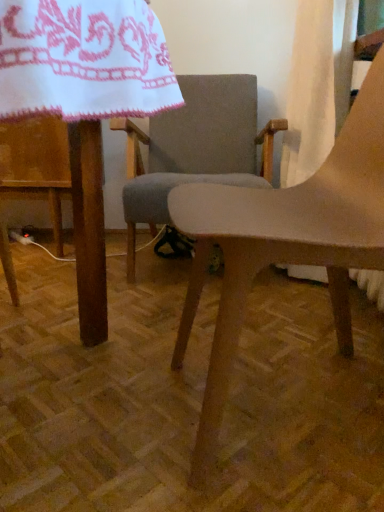
You are a GUI agent. You are given a task and a screenshot of the screen. Output one action in this format:
    pyautogui.click(x=<x>, y=<y>)
    Task: Click on the white embroidered cloth at upper left
    
    Given the screenshot: What is the action you would take?
    pyautogui.click(x=84, y=60)

Measure the distance between matte wood chair at center, the second chair viewed from the back, and camera.

They are 25.62 inches apart.

At what (x,y) coordinates should I click in order to perform the action: click on matte wood table at center. Please return your answer as a coordinate pair (x, y). Looking at the image, I should click on (85, 103).

Describe the element at coordinates (195, 148) in the screenshot. I see `gray fabric chair at center, positioned as the 2th chair in front-to-back order` at that location.

What is the approximate width of gray fabric chair at center, which is the 1th chair in back-to-front order?

29.66 inches.

This screenshot has width=384, height=512. Find the location of `white embroidered cloth at upper left`. white embroidered cloth at upper left is located at coordinates pyautogui.click(x=84, y=60).

Which chair is the 1st one when counting from the right side of the matte wood table at center? Please provide its 2D coordinates.

[(195, 148)]

Does matte wood table at center turn towards gray fabric chair at center, which is the 1th chair in back-to-front order?

No.

Would you say matte wood table at center is a long distance from gray fabric chair at center, which is the 1th chair in back-to-front order?

They are positioned close to each other.

Is white embroidered cloth at upper left with gray fabric chair at center, positioned as the 2th chair in front-to-back order?

white embroidered cloth at upper left is not next to gray fabric chair at center, positioned as the 2th chair in front-to-back order, and they're not touching.

Is white embroidered cloth at upper left inside the boundaries of gray fabric chair at center, positioned as the 2th chair in front-to-back order, or outside?

The correct answer is: outside.

In the scene shown: Which object is wider, white embroidered cloth at upper left or gray fabric chair at center, positioned as the 2th chair in front-to-back order?

gray fabric chair at center, positioned as the 2th chair in front-to-back order, is wider.

Is point (14, 35) closer or farther from the camera than point (166, 157)?

Point (14, 35).

Is matte wood table at center oriented away from white fabric curtain at upper right?

That's not correct — matte wood table at center is not looking away from white fabric curtain at upper right.

Is point (82, 233) positioned before point (290, 79)?

Yes, point (82, 233) is in front of point (290, 79).

The width and height of the screenshot is (384, 512). Find the location of `curtain lying above the matte wood table at center (from the image's perspective)`. curtain lying above the matte wood table at center (from the image's perspective) is located at coordinates (317, 84).

Is the depth of matte wood table at center greater than that of white fabric curtain at upper right?

No, matte wood table at center is in front of white fabric curtain at upper right.

From the image's perspective, between white fabric curtain at upper right and gray fabric chair at center, positioned as the 2th chair in front-to-back order, which one is located above?

From the image's view, white fabric curtain at upper right is above.

Is white fabric curtain at upper right facing towards gray fabric chair at center, positioned as the 2th chair in front-to-back order?

Yes, white fabric curtain at upper right is facing gray fabric chair at center, positioned as the 2th chair in front-to-back order.

Is white fabric curtain at upper right positioned far away from gray fabric chair at center, which is the 1th chair in back-to-front order?

No, white fabric curtain at upper right is in close proximity to gray fabric chair at center, which is the 1th chair in back-to-front order.

Considering the sizes of white fabric curtain at upper right and gray fabric chair at center, positioned as the 2th chair in front-to-back order, in the image, is white fabric curtain at upper right taller or shorter than gray fabric chair at center, positioned as the 2th chair in front-to-back order,?

white fabric curtain at upper right is shorter than gray fabric chair at center, positioned as the 2th chair in front-to-back order.

In order to click on curtain lying in front of the gray fabric chair at center, which is the 1th chair in back-to-front order in this screenshot , I will do `click(317, 84)`.

Considering their positions, is gray fabric chair at center, which is the 1th chair in back-to-front order, located in front of or behind white fabric curtain at upper right?

In the image, gray fabric chair at center, which is the 1th chair in back-to-front order, appears behind white fabric curtain at upper right.

Is gray fabric chair at center, which is the 1th chair in back-to-front order, oriented towards white fabric curtain at upper right?

No, gray fabric chair at center, which is the 1th chair in back-to-front order, does not turn towards white fabric curtain at upper right.

From a real-world perspective, which is physically below, gray fabric chair at center, which is the 1th chair in back-to-front order, or white fabric curtain at upper right?

From a 3D spatial view, gray fabric chair at center, which is the 1th chair in back-to-front order, is below.

Does matte wood chair at center, the second chair viewed from the back, have a lesser height compared to white embroidered cloth at upper left?

In fact, matte wood chair at center, the second chair viewed from the back, may be taller than white embroidered cloth at upper left.

Relative to white embroidered cloth at upper left, is matte wood chair at center, the 1th chair when ordered from front to back, in front or behind?

matte wood chair at center, the 1th chair when ordered from front to back, is behind white embroidered cloth at upper left.

Between point (380, 141) and point (107, 33), which one is positioned behind?

The point (380, 141) is more distant.

What's the angular difference between matte wood chair at center, the 1th chair when ordered from front to back, and white embroidered cloth at upper left's facing directions?

3.87 degrees.

How far apart are matte wood table at center and white embroidered cloth at upper left?

41.49 centimeters.

Which is farther from the camera, [87,46] or [147,8]?

The point [147,8] is more distant.

Which is more to the right, matte wood table at center or white embroidered cloth at upper left?

From the viewer's perspective, white embroidered cloth at upper left appears more on the right side.

Is matte wood table at center further to camera compared to white embroidered cloth at upper left?

That is False.

Where is `the 2nd chair above when counting from the matte wood table at center (from the image's perspective)`? the 2nd chair above when counting from the matte wood table at center (from the image's perspective) is located at coordinates (195, 148).

Locate an element on the screen. The width and height of the screenshot is (384, 512). the 2nd chair behind the white embroidered cloth at upper left, counting from the anchor's position is located at coordinates (195, 148).

Looking at the image, which one is located closer to white embroidered cloth at upper left, matte wood chair at center, the 1th chair when ordered from front to back, or gray fabric chair at center, positioned as the 2th chair in front-to-back order?

matte wood chair at center, the 1th chair when ordered from front to back, lies closer to white embroidered cloth at upper left than the other object.

When comparing their distances from matte wood chair at center, the 1th chair when ordered from front to back, does white fabric curtain at upper right or matte wood table at center seem further?

The object further to matte wood chair at center, the 1th chair when ordered from front to back, is white fabric curtain at upper right.

When comparing their distances from gray fabric chair at center, which is the 1th chair in back-to-front order, does matte wood chair at center, the second chair viewed from the back, or matte wood table at center seem closer?

matte wood chair at center, the second chair viewed from the back, is closer to gray fabric chair at center, which is the 1th chair in back-to-front order.

Based on their spatial positions, is matte wood chair at center, the 1th chair when ordered from front to back, or white embroidered cloth at upper left closer to white fabric curtain at upper right?

matte wood chair at center, the 1th chair when ordered from front to back, is closer to white fabric curtain at upper right.

Considering their positions, is gray fabric chair at center, positioned as the 2th chair in front-to-back order, positioned closer to matte wood chair at center, the 1th chair when ordered from front to back, than matte wood table at center?

Based on the image, matte wood table at center appears to be nearer to matte wood chair at center, the 1th chair when ordered from front to back.

From the image, which object appears to be nearer to gray fabric chair at center, which is the 1th chair in back-to-front order, matte wood table at center or white embroidered cloth at upper left?

matte wood table at center.

Which object lies further to the anchor point gray fabric chair at center, which is the 1th chair in back-to-front order, white fabric curtain at upper right or matte wood chair at center, the second chair viewed from the back?

Based on the image, matte wood chair at center, the second chair viewed from the back, appears to be further to gray fabric chair at center, which is the 1th chair in back-to-front order.

From the image, which object appears to be nearer to matte wood table at center, gray fabric chair at center, which is the 1th chair in back-to-front order, or white embroidered cloth at upper left?

white embroidered cloth at upper left is positioned closer to the anchor matte wood table at center.

Locate an element on the screen. curtain between matte wood chair at center, the 1th chair when ordered from front to back, and gray fabric chair at center, positioned as the 2th chair in front-to-back order, from front to back is located at coordinates (317, 84).

Image resolution: width=384 pixels, height=512 pixels. Find the location of `chair positioned between matte wood table at center and gray fabric chair at center, which is the 1th chair in back-to-front order, from near to far`. chair positioned between matte wood table at center and gray fabric chair at center, which is the 1th chair in back-to-front order, from near to far is located at coordinates (284, 243).

Identify the location of blanket between matte wood table at center and matte wood chair at center, the second chair viewed from the back. This screenshot has height=512, width=384. (84, 60).

Where is `chair between white embroidered cloth at upper left and white fabric curtain at upper right in the front-back direction`? This screenshot has height=512, width=384. chair between white embroidered cloth at upper left and white fabric curtain at upper right in the front-back direction is located at coordinates (284, 243).